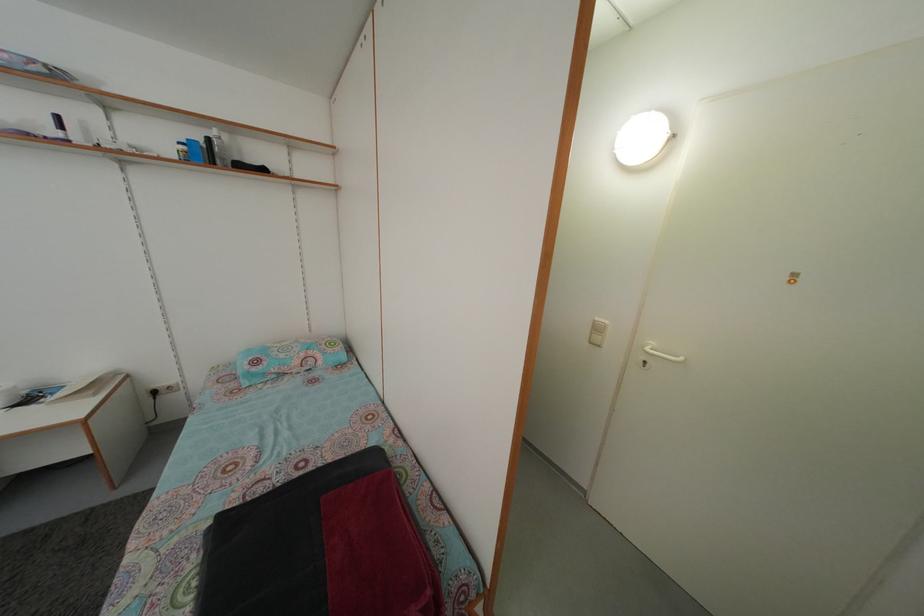
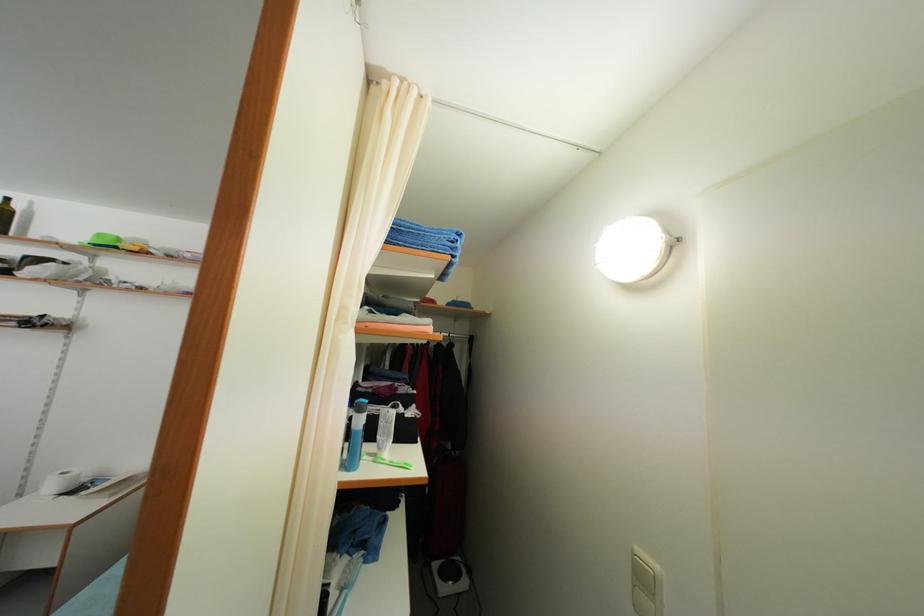
Find the pixel in the second image that matches point (603, 336) in the first image.

(649, 586)